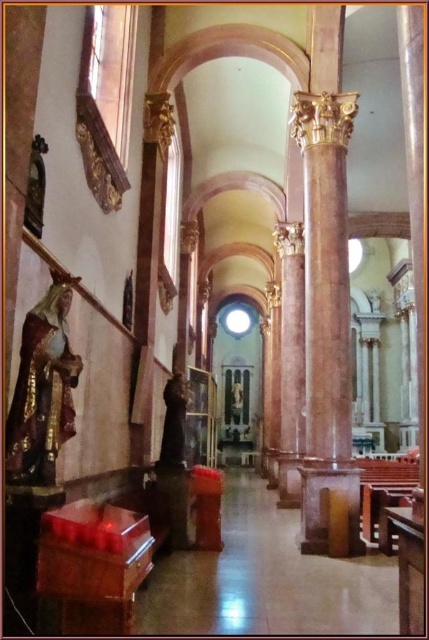
Measure the distance between marble column at center and gold polished statue at left.

marble column at center is 13.12 meters from gold polished statue at left.

Does point (344, 266) come behind point (33, 332)?

Yes, it is behind point (33, 332).

At what (x,y) coordinates should I click in order to perform the action: click on marble column at center. Please return your answer as a coordinate pair (x, y). Image resolution: width=429 pixels, height=640 pixels. Looking at the image, I should click on (326, 326).